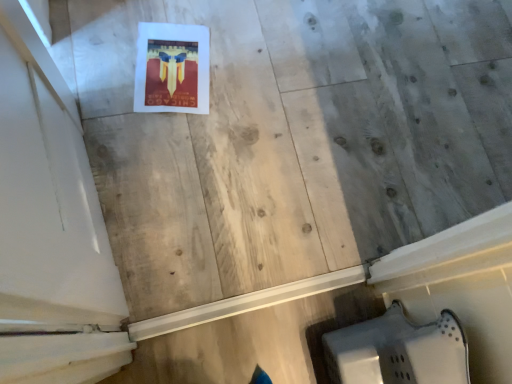
The width and height of the screenshot is (512, 384). What are the coordinates of `vacant region under white matte door at upper left (from a real-world perspective)` in the screenshot? It's located at (108, 213).